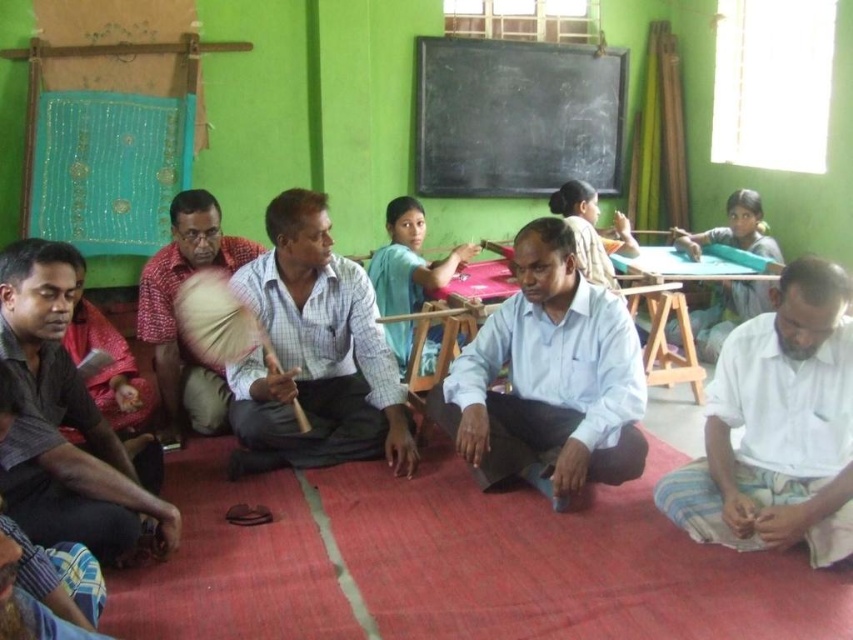
Can you confirm if black chalkboard at upper center is positioned to the right of reddish-brown fabric at center?

Indeed, black chalkboard at upper center is positioned on the right side of reddish-brown fabric at center.

Does black chalkboard at upper center come in front of reddish-brown fabric at center?

No.

Is point (503, 77) closer to camera compared to point (196, 426)?

No, it is not.

Identify the location of black chalkboard at upper center. (515, 116).

Who is taller, white cotton shirt at lower right or black chalkboard at upper center?

With more height is black chalkboard at upper center.

Is point (799, 353) farther from camera compared to point (582, 77)?

No.

Image resolution: width=853 pixels, height=640 pixels. What are the coordinates of `white cotton shirt at lower right` in the screenshot? It's located at (776, 428).

In the scene shown: Which is below, black chalkboard at upper center or dark gray shirt at left?

dark gray shirt at left

Is black chalkboard at upper center bigger than dark gray shirt at left?

Yes, black chalkboard at upper center is bigger than dark gray shirt at left.

Measure the distance between point (492, 145) and camera.

The distance of point (492, 145) from camera is 5.15 meters.

Identify the location of black chalkboard at upper center. (515, 116).